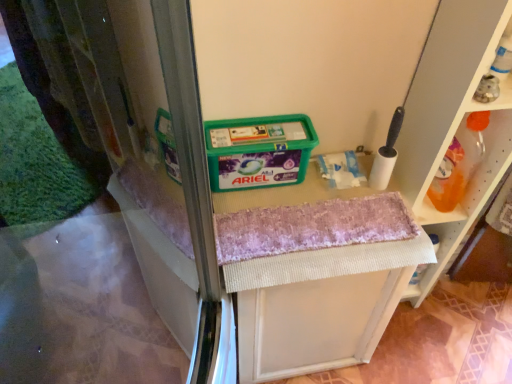
This screenshot has width=512, height=384. Identify the location of vacant space to the right of white plastic shelf at right, which is counted as the first shelf, starting from the front. (444, 310).